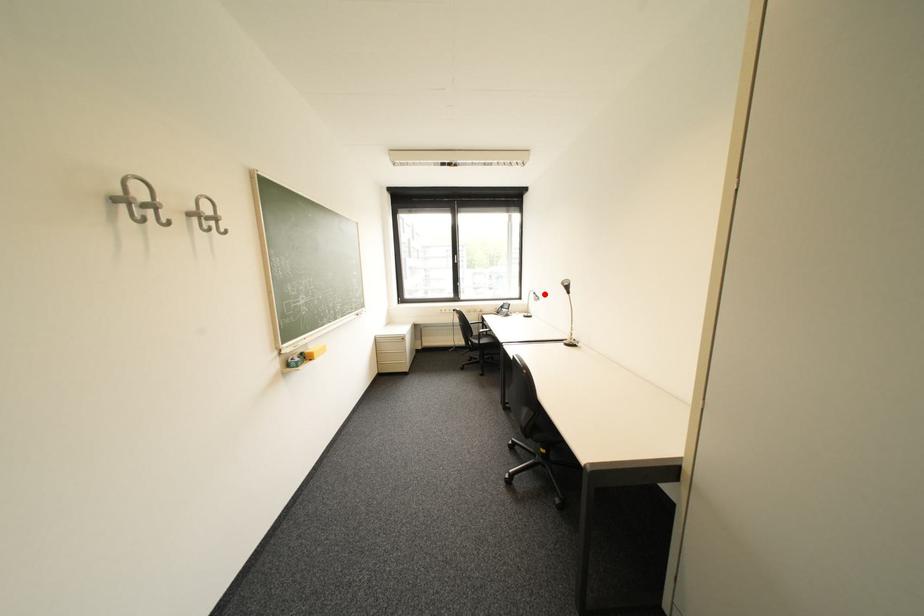
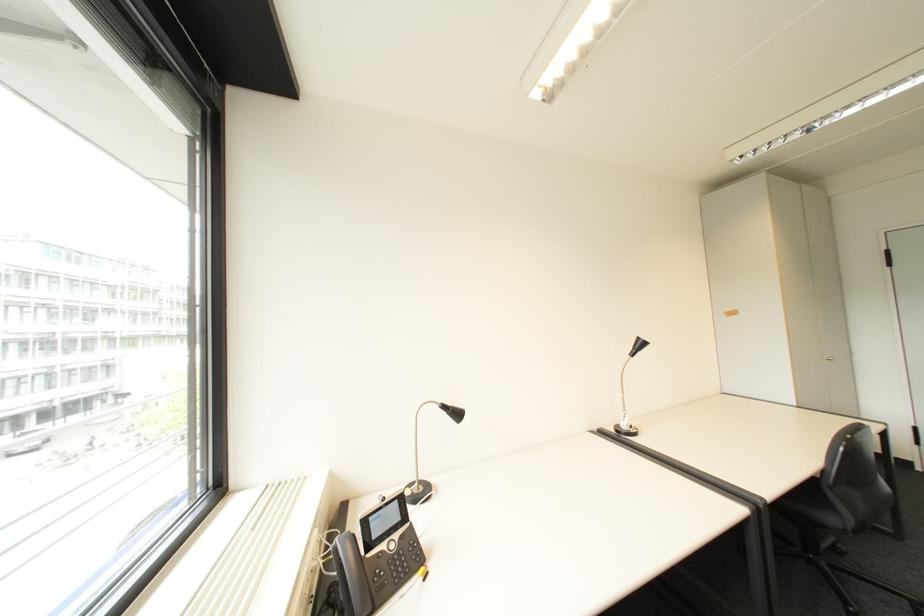
Question: I am providing you with two images of the same scene from different viewpoints. Given a red point in image1, look at the same physical point in image2. Is it:

Choices:
 (A) Closer to the viewpoint
 (B) Farther from the viewpoint

Answer: (B)